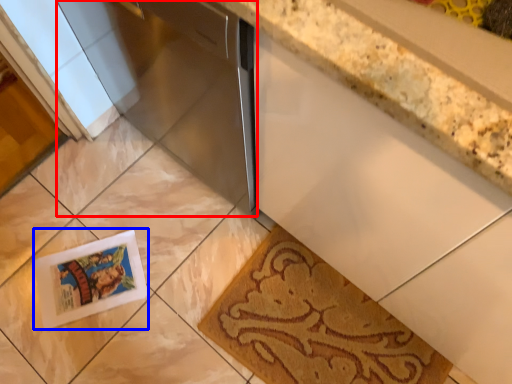
Question: Which object is further to the camera taking this photo, appliance (highlighted by a red box) or postcard (highlighted by a blue box)?

Choices:
 (A) appliance
 (B) postcard

Answer: (B)